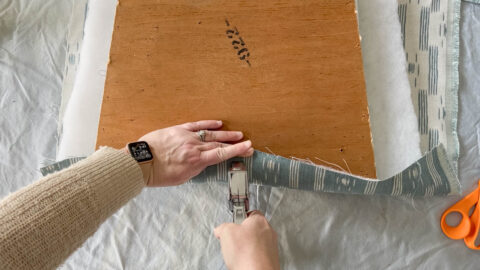
I want to click on wood chair base, so click(x=318, y=60).